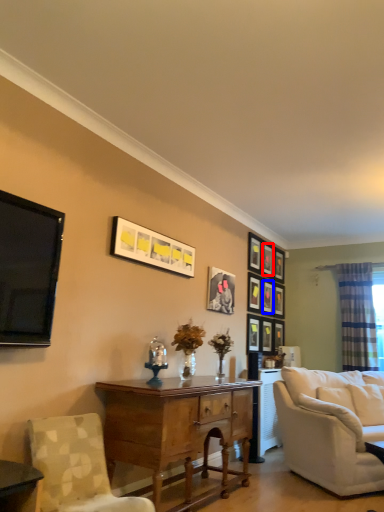
Question: Among these objects, which one is farthest to the camera, picture frame (highlighted by a red box) or picture frame (highlighted by a blue box)?

Choices:
 (A) picture frame
 (B) picture frame

Answer: (A)